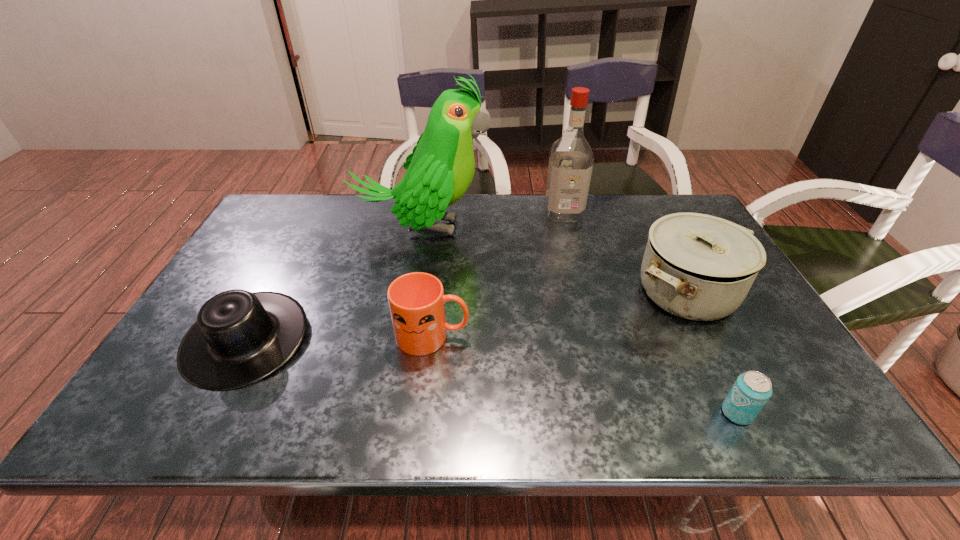
Find the location of a particular element. parakeet is located at coordinates (440, 169).

This screenshot has height=540, width=960. Find the location of `the third object from right to left`. the third object from right to left is located at coordinates (571, 159).

Where is `the second tallest object`? The image size is (960, 540). the second tallest object is located at coordinates (571, 159).

Locate an element on the screen. This screenshot has width=960, height=540. saucepan is located at coordinates tap(696, 266).

What are the coordinates of `the third shortest object` in the screenshot? It's located at (416, 300).

The height and width of the screenshot is (540, 960). I want to click on dress hat, so click(240, 337).

At what (x,y) coordinates should I click in order to perform the action: click on beer can. Please return your answer as a coordinate pair (x, y). The width and height of the screenshot is (960, 540). Looking at the image, I should click on (750, 392).

You are a GUI agent. You are given a task and a screenshot of the screen. Output one action in this format:
    pyautogui.click(x=<x>, y=<y>)
    Task: Click on the vacant position located on the beak of the parakeet
    The image size is (960, 540).
    Given the screenshot: What is the action you would take?
    pyautogui.click(x=530, y=228)

At what (x,y) coordinates should I click in order to perform the action: click on vacant area situated 0.060m on the front-facing side of the third object from right to left. Please return your answer as a coordinate pair (x, y). The image size is (960, 540). Looking at the image, I should click on (569, 234).

In order to click on free spot located on the back of the saucepan in this screenshot , I will do `click(647, 218)`.